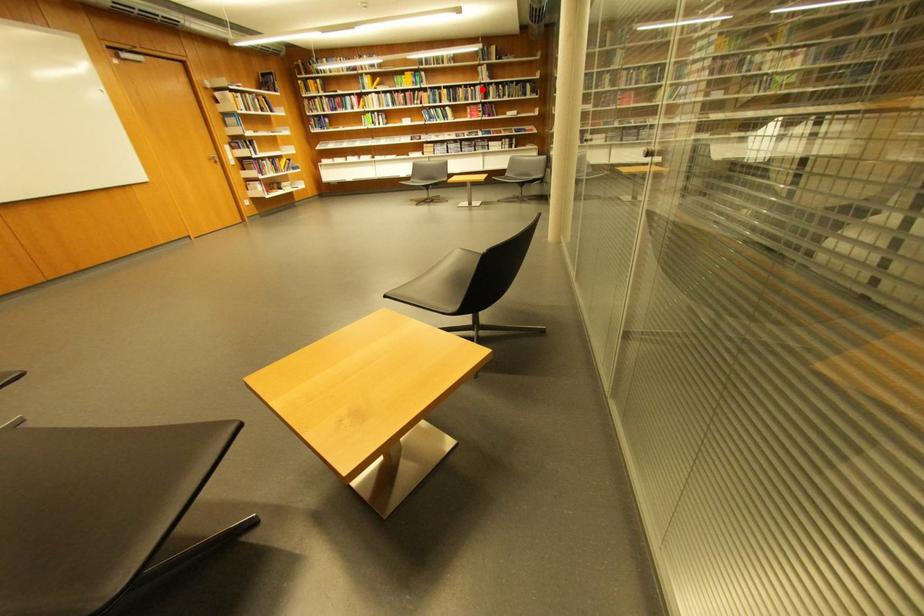
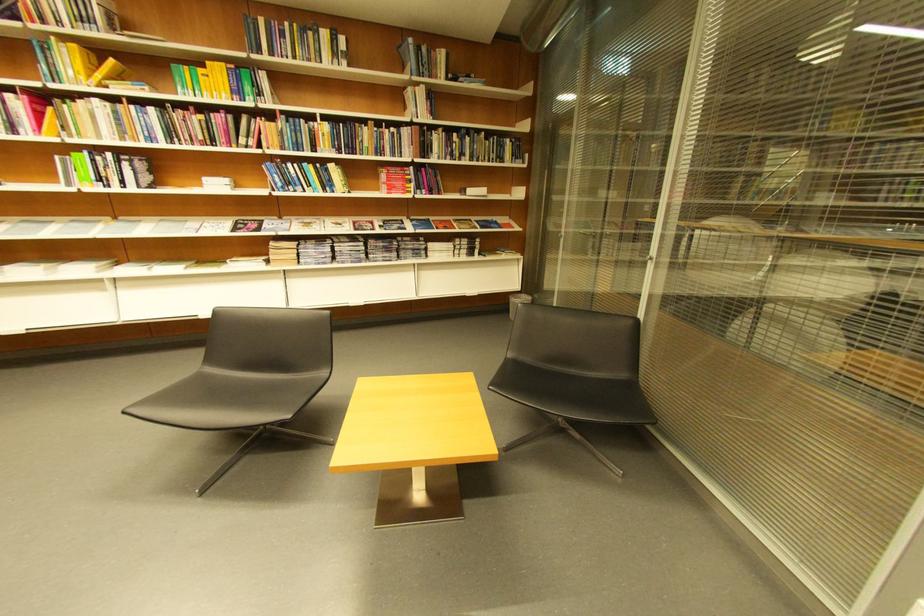
Question: I am providing you with two images of the same scene from different viewpoints. A red point is shown in image1. For the corresponding object point in image2, is it positioned nearer or farther from the camera?

Choices:
 (A) Nearer
 (B) Farther

Answer: (B)